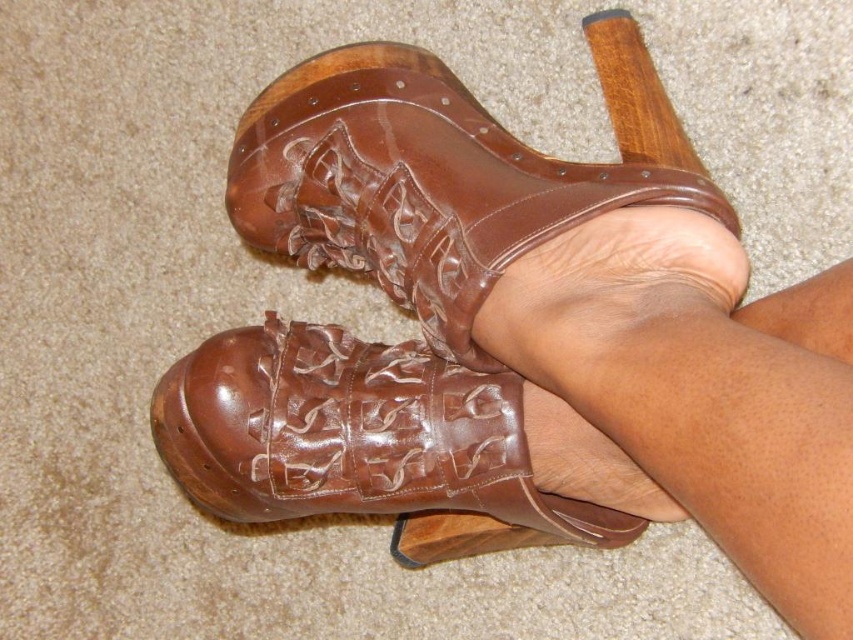
How much distance is there between brown leather boot at center and brown leather shoe at center?

brown leather boot at center and brown leather shoe at center are 6.05 inches apart.

Is brown leather boot at center smaller than brown leather shoe at center?

Actually, brown leather boot at center might be larger than brown leather shoe at center.

Image resolution: width=853 pixels, height=640 pixels. In order to click on brown leather boot at center in this screenshot , I will do `click(442, 173)`.

Which is more to the right, shiny brown leather shoes at center or brown leather shoe at center?

shiny brown leather shoes at center is more to the right.

Between point (672, 346) and point (277, 451), which one is positioned in front?

Point (672, 346) is in front.

Is point (686, 308) farther from viewer compared to point (196, 467)?

No, it is in front of (196, 467).

In order to click on shiny brown leather shoes at center in this screenshot , I will do `click(701, 388)`.

Is shiny brown leather shoes at center positioned before brown leather boot at center?

Yes, it is in front of brown leather boot at center.

Who is positioned more to the left, shiny brown leather shoes at center or brown leather boot at center?

From the viewer's perspective, brown leather boot at center appears more on the left side.

Is point (792, 484) positioned before point (433, 196)?

Yes, it is in front of point (433, 196).

Find the location of a particular element. shiny brown leather shoes at center is located at coordinates (701, 388).